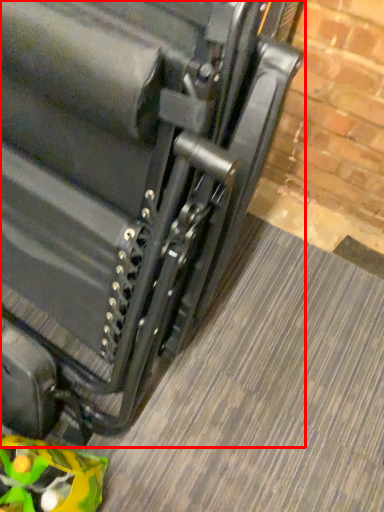
Question: From the image's perspective, where is suitcase (annotated by the red box) located in relation to toy in the image?

Choices:
 (A) below
 (B) above

Answer: (B)